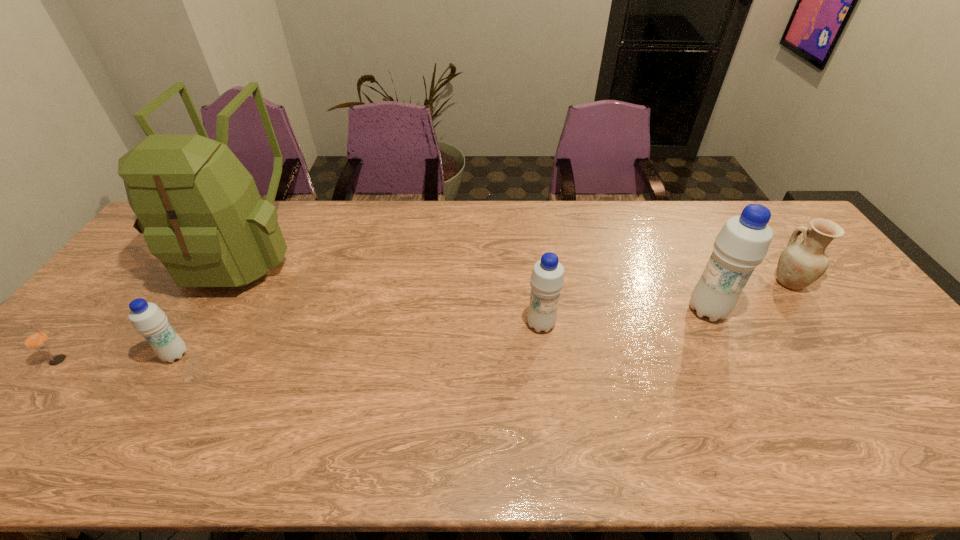
Where is `the nearest water bottle`? This screenshot has width=960, height=540. the nearest water bottle is located at coordinates (147, 318).

Find the location of a particular element. The image size is (960, 540). the leftmost water bottle is located at coordinates (147, 318).

What are the coordinates of `the fourth object from left to right` in the screenshot? It's located at coord(547,279).

Identify the location of the second shortest water bottle. (547, 279).

Locate an element on the screen. the rightmost water bottle is located at coordinates point(742,243).

The image size is (960, 540). Identify the location of the fifth object from left to right. (742, 243).

Where is `the tallest object`? Image resolution: width=960 pixels, height=540 pixels. the tallest object is located at coordinates (199, 209).

The image size is (960, 540). I want to click on the rightmost object, so click(800, 264).

At what (x,y) coordinates should I click in order to perform the action: click on the shortest object. Please return your answer as a coordinate pair (x, y). Looking at the image, I should click on (36, 339).

Where is `the leftmost object`? This screenshot has width=960, height=540. the leftmost object is located at coordinates (36, 339).